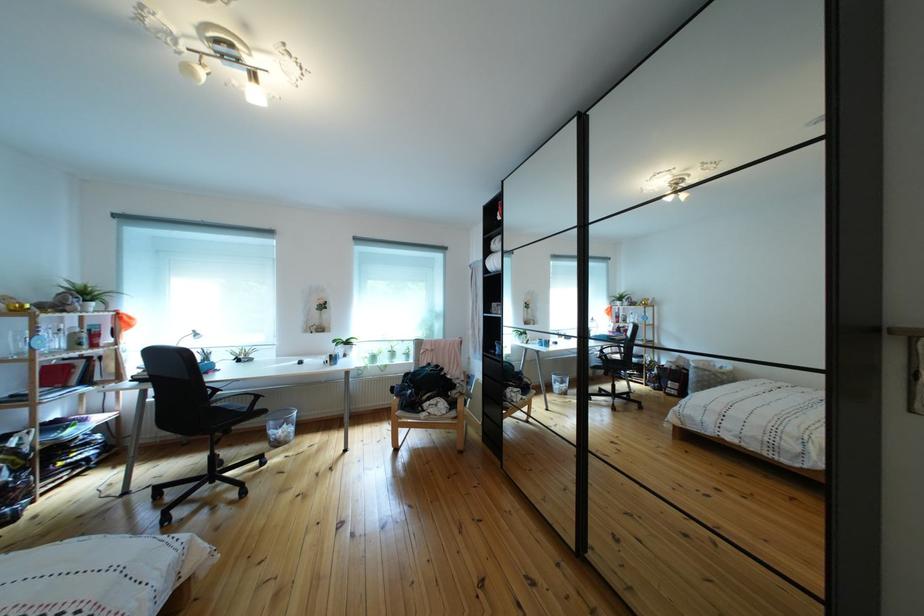
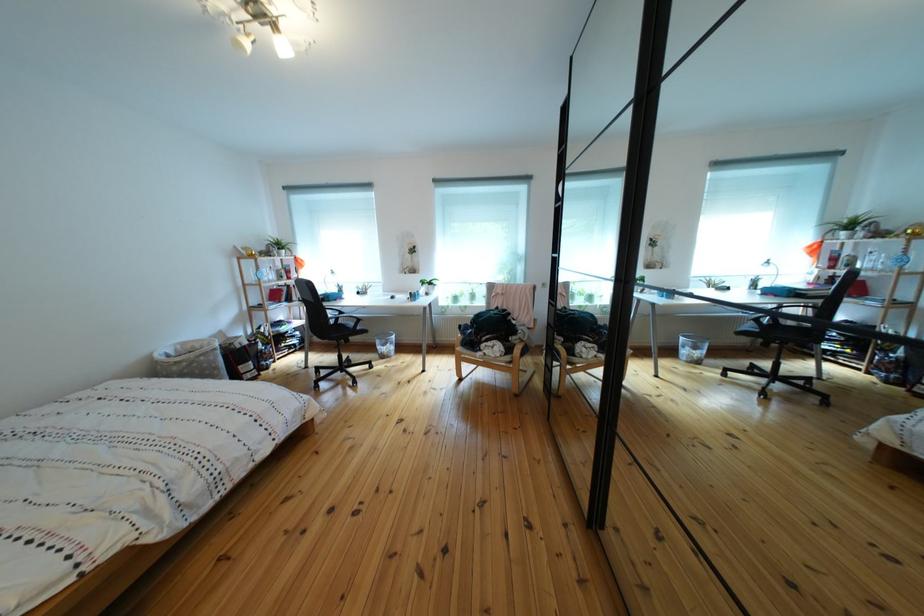
Find the pixel in the second image that matches (228,47) in the first image.

(258, 10)